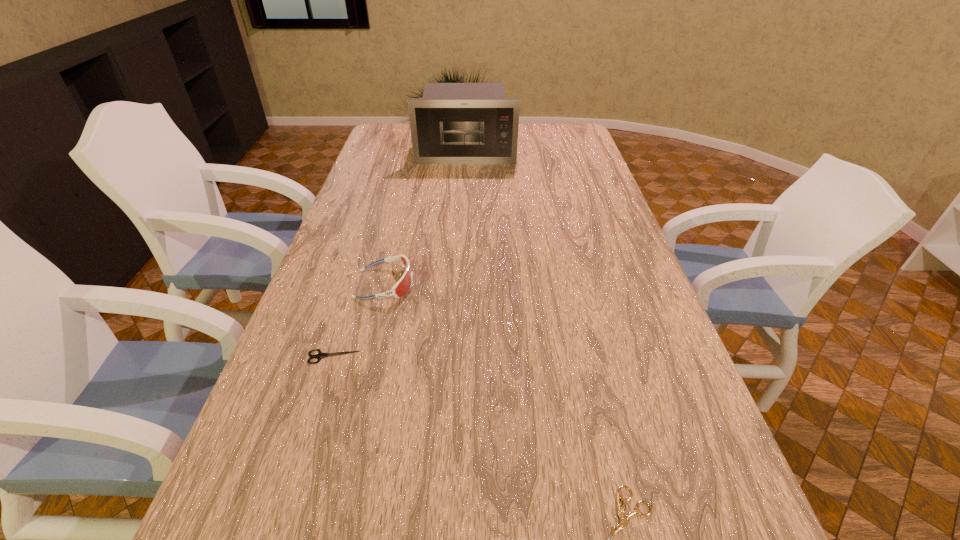
Find the location of a particular element. The width and height of the screenshot is (960, 540). the farthest object is located at coordinates (453, 123).

I want to click on microwave oven, so click(x=453, y=123).

This screenshot has height=540, width=960. Identify the location of the second farthest object. (404, 284).

Where is `the third shortest object`? The image size is (960, 540). the third shortest object is located at coordinates (404, 284).

The height and width of the screenshot is (540, 960). Identify the location of the third farthest object. pyautogui.click(x=320, y=355).

Identify the location of the second shortest object. The height and width of the screenshot is (540, 960). (320, 355).

I want to click on vacant space located 0.100m on the front-facing side of the farthest object, so click(465, 177).

Find the location of a particular element. The image size is (960, 540). vacant space located 0.390m on the front-facing side of the third shortest object is located at coordinates (557, 284).

At what (x,y) coordinates should I click in order to perform the action: click on vacant space situated on the front of the left shears. Please return your answer as a coordinate pair (x, y). Image resolution: width=960 pixels, height=540 pixels. Looking at the image, I should click on (316, 410).

Where is `object located in the far edge section of the desktop`? The width and height of the screenshot is (960, 540). object located in the far edge section of the desktop is located at coordinates (453, 123).